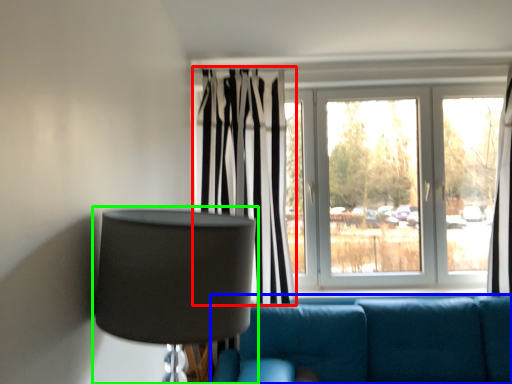
Question: Based on their relative distances, which object is nearer to curtain (highlighted by a red box)? Choose from studio couch (highlighted by a blue box) and lamp (highlighted by a green box).

Choices:
 (A) studio couch
 (B) lamp

Answer: (A)